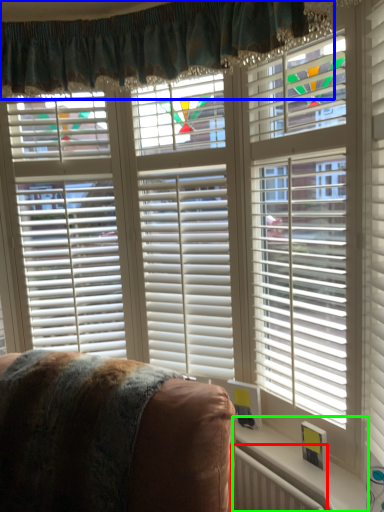
Question: Estimate the real-world distances between objects in this image. Which object is farther from radiator (highlighted by a red box), curtain (highlighted by a blue box) or window sill (highlighted by a green box)?

Choices:
 (A) curtain
 (B) window sill

Answer: (A)